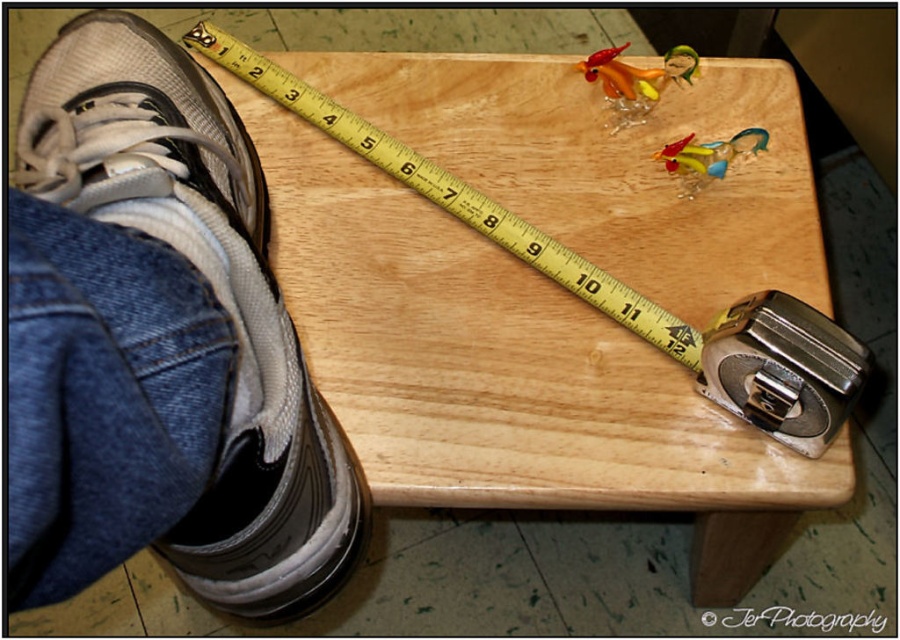
You are standing next to the wooden surface and want to place a small item between the white mesh shoe at lower left and the edge of the wooden surface. Is there enough space to fit the item?

The white mesh shoe at lower left is located at point (194, 305), but without knowing the exact dimensions of the wooden surface and the item, it is impossible to determine if there is enough space. Please provide more information about the size of the item and the wooden surface.

You are standing next to the wooden surface and want to place a small sticker exactly at the point labeled as point (452, 195). Where should you place the sticker on the wooden surface?

The point (452, 195) corresponds to the yellowish wood ruler at upper center, so place the sticker on the yellowish wood ruler at upper center.